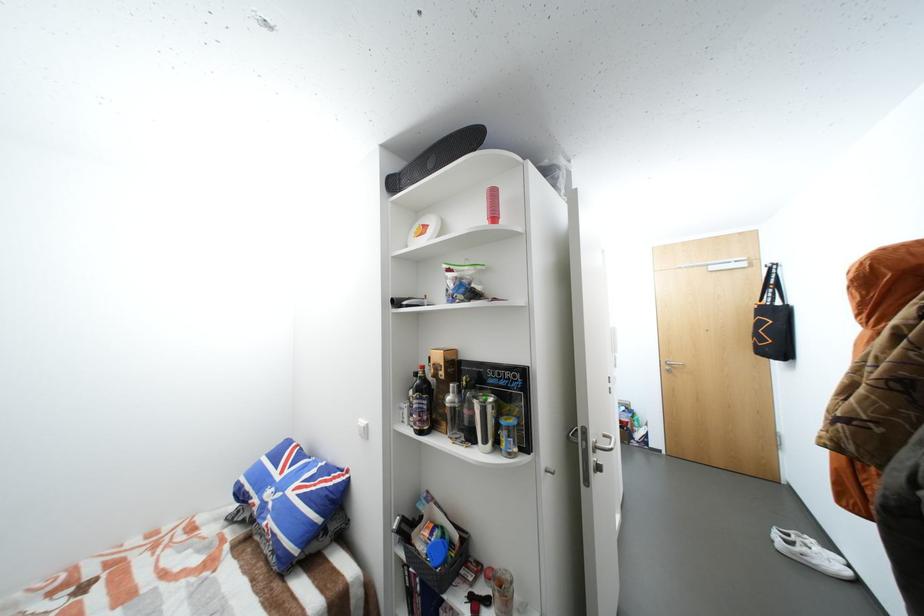
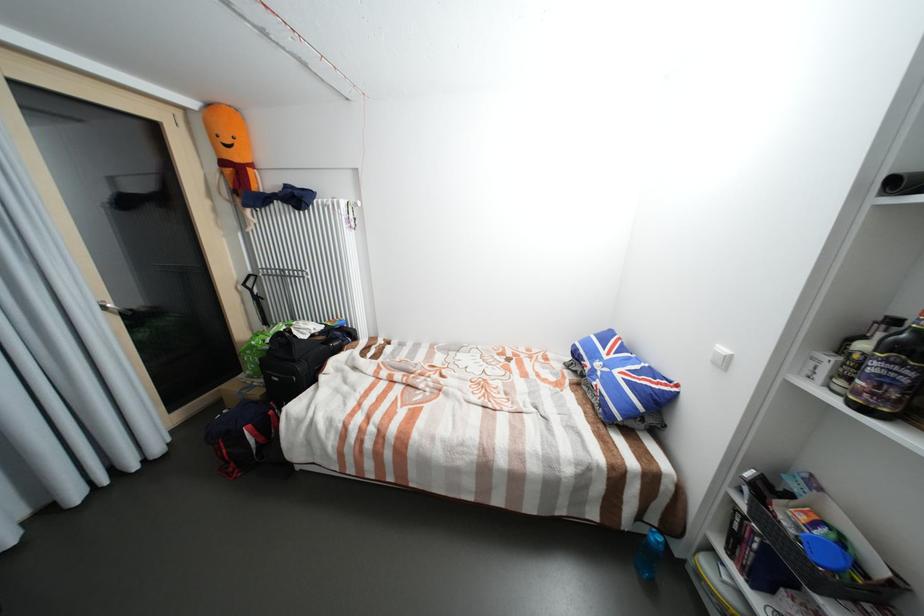
The images are taken continuously from a first-person perspective. In which direction is your viewpoint rotating?

The camera rotated toward left-down.